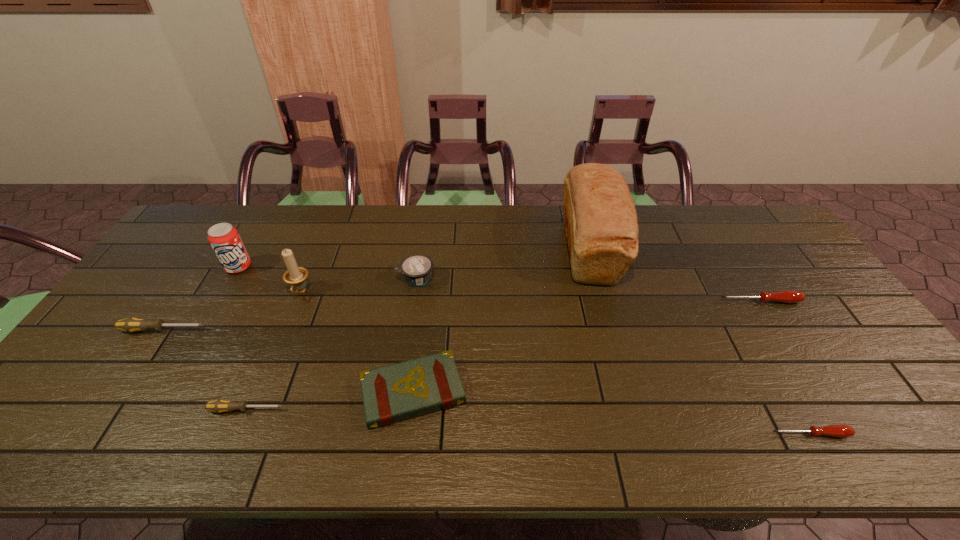
At what (x,y) coordinates should I click in order to perform the action: click on blank space located on the right of the brown book. Please return your answer as a coordinate pair (x, y). The image size is (960, 540). Looking at the image, I should click on (565, 392).

At what (x,y) coordinates should I click in order to perform the action: click on vacant point located 0.250m at the tip of the nearer gray screwdriver. Please return your answer as a coordinate pair (x, y). Image resolution: width=960 pixels, height=540 pixels. Looking at the image, I should click on (391, 410).

Image resolution: width=960 pixels, height=540 pixels. I want to click on free location located 0.080m on the back of the shortest object, so click(x=789, y=397).

Where is `object situated at the far edge`? The image size is (960, 540). object situated at the far edge is located at coordinates (601, 225).

Image resolution: width=960 pixels, height=540 pixels. Identify the location of book that is positioned at the near edge. (400, 391).

Locate an element on the screen. screwdriver that is at the near edge is located at coordinates (842, 431).

You are a GUI agent. You are given a task and a screenshot of the screen. Output one action in this format:
    pyautogui.click(x=<x>, y=<y>)
    Task: Click on the object at the left edge
    
    Given the screenshot: What is the action you would take?
    pyautogui.click(x=132, y=324)

I want to click on object that is positioned at the right edge, so click(784, 296).

The image size is (960, 540). In order to click on free point at the far edge in this screenshot , I will do `click(706, 217)`.

In the image, there is a desktop. Identify the location of free space at the left edge. (127, 347).